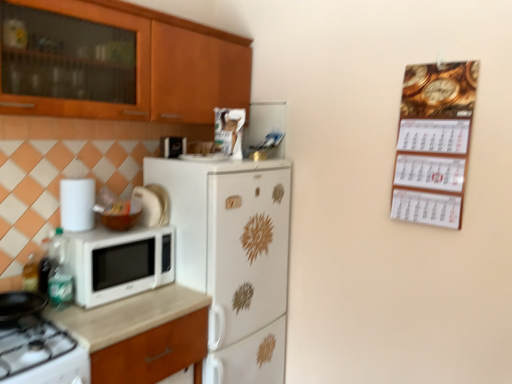
I want to click on blank space situated above beige laminate countertop at lower left (from a real-world perspective), so click(121, 302).